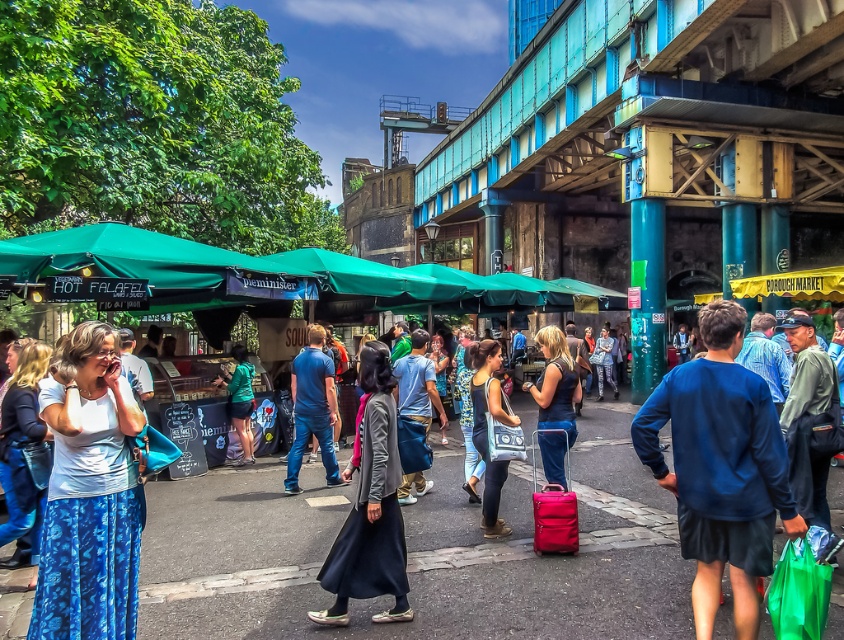
Question: Which point is farther to the camera?

Choices:
 (A) blue fabric bag at center
 (B) blue denim jeans at center
 (C) green fabric canopy at center

Answer: (B)

Question: Considering the real-world distances, which object is farthest from the blue fabric sweatshirt at center?

Choices:
 (A) blue denim jeans at center
 (B) dark gray fabric coat at center
 (C) green fabric canopy at center
 (D) blue tie-dye skirt at lower left

Answer: (C)

Question: Can you confirm if dark gray fabric coat at center is wider than green fabric jacket at center?

Choices:
 (A) no
 (B) yes

Answer: (B)

Question: Is blue fabric sweatshirt at center bigger than matte blue dress at center?

Choices:
 (A) no
 (B) yes

Answer: (A)

Question: Is the position of blue denim jeans at center more distant than that of matte blue dress at center?

Choices:
 (A) no
 (B) yes

Answer: (B)

Question: Which point appears farthest from the camera in this image?

Choices:
 (A) 347,540
 (B) 751,388
 (C) 556,474

Answer: (C)